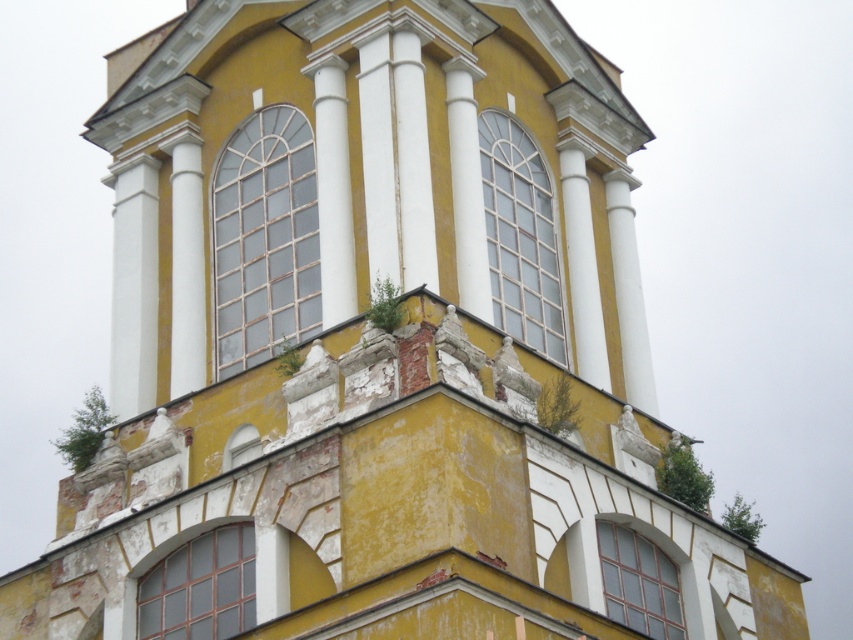
Does matte glass window at center appear over clear glass window at lower right?

Yes, matte glass window at center is above clear glass window at lower right.

Can you confirm if matte glass window at center is taller than clear glass window at lower right?

Indeed, matte glass window at center has a greater height compared to clear glass window at lower right.

The width and height of the screenshot is (853, 640). What do you see at coordinates (265, 240) in the screenshot?
I see `matte glass window at center` at bounding box center [265, 240].

Where is `matte glass window at center`? matte glass window at center is located at coordinates (265, 240).

Can you confirm if matte glass window at lower center is bigger than clear glass window at lower right?

Yes, matte glass window at lower center is bigger than clear glass window at lower right.

Is matte glass window at lower center positioned behind clear glass window at lower right?

No, it is not.

Is point (241, 588) closer to camera compared to point (665, 563)?

Yes, point (241, 588) is closer to viewer.

Locate an element on the screen. matte glass window at lower center is located at coordinates (201, 588).

Between clear glass window at center and matte glass window at lower center, which one appears on the right side from the viewer's perspective?

clear glass window at center is more to the right.

This screenshot has height=640, width=853. Describe the element at coordinates (520, 236) in the screenshot. I see `clear glass window at center` at that location.

Locate an element on the screen. This screenshot has width=853, height=640. clear glass window at center is located at coordinates (520, 236).